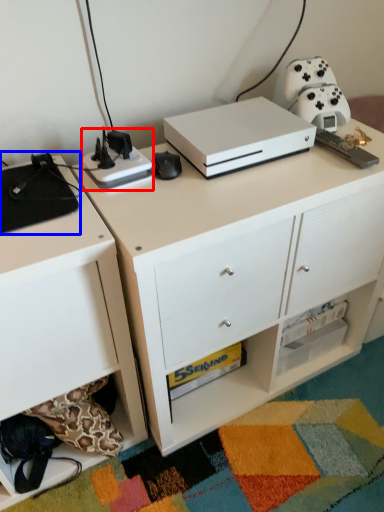
Question: Among these objects, which one is farthest to the camera, appliance (highlighted by a red box) or appliance (highlighted by a blue box)?

Choices:
 (A) appliance
 (B) appliance

Answer: (A)